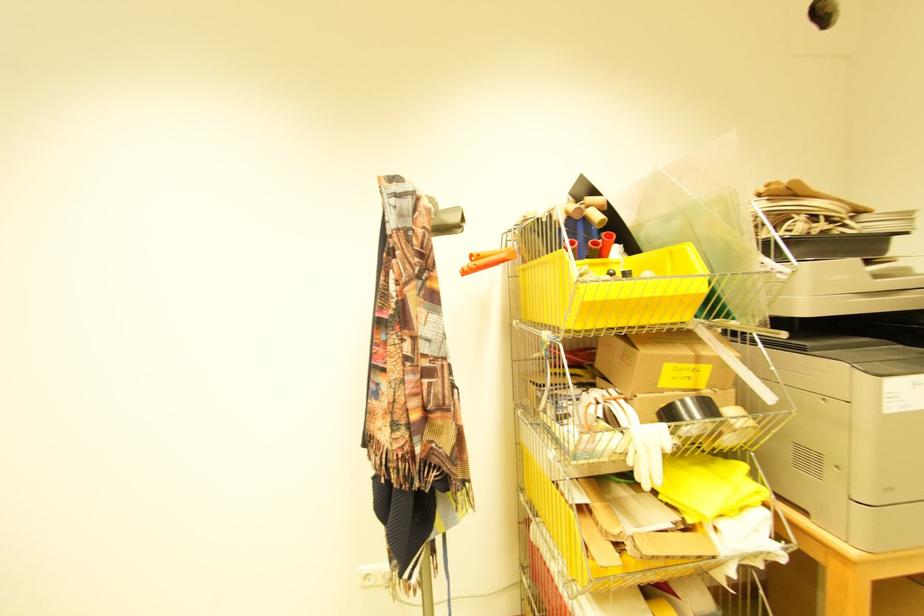
Image resolution: width=924 pixels, height=616 pixels. What are the coordinates of `red plastic cup` in the screenshot? It's located at (601, 246).